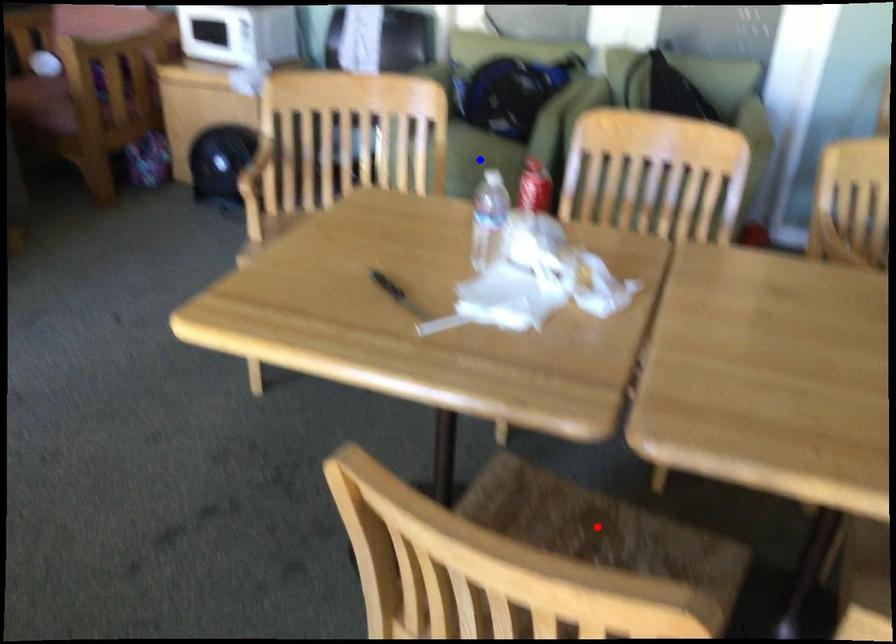
Question: In the image, two points are highlighted. Which point is nearer to the camera? Reply with the corresponding letter.

Choices:
 (A) blue point
 (B) red point

Answer: (B)